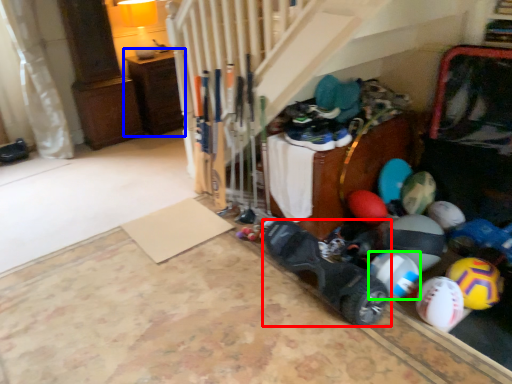
Question: Which object is the farthest from footwear (highlighted by a red box)? Choose among these: furniture (highlighted by a blue box) or beach ball (highlighted by a green box).

Choices:
 (A) furniture
 (B) beach ball

Answer: (A)